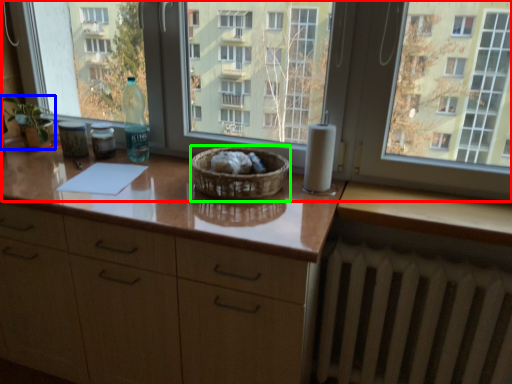
Question: Based on their relative distances, which object is nearer to window (highlighted by a red box)? Choose from houseplant (highlighted by a blue box) and basket (highlighted by a green box).

Choices:
 (A) houseplant
 (B) basket

Answer: (B)